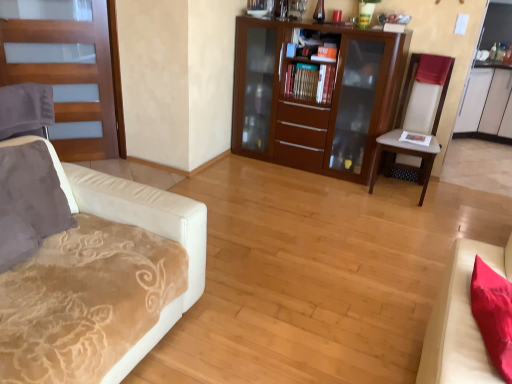
What do you see at coordinates (461, 320) in the screenshot? The image size is (512, 384). I see `velvet beige studio couch at lower right, the 2th studio couch when ordered from left to right` at bounding box center [461, 320].

This screenshot has height=384, width=512. Describe the element at coordinates (68, 70) in the screenshot. I see `wooden door at left` at that location.

What do you see at coordinates (315, 96) in the screenshot?
I see `wooden cabinet at center` at bounding box center [315, 96].

In order to face wooden cabinet at center, should I rotate leftwards or rightwards?

To align with it, rotate right about 7.935°.

Locate an element on the screen. velvet beige studio couch at lower right, the 2th studio couch when ordered from left to right is located at coordinates (461, 320).

Is wooden door at left in contact with suede-like gray pillow at left?

No, wooden door at left is not next to suede-like gray pillow at left.

I want to click on pillow above the wooden door at left (from a real-world perspective), so click(35, 187).

Is wooden door at left looking in the opposite direction of suede-like gray pillow at left?

No, wooden door at left is not facing the opposite direction of suede-like gray pillow at left.

Is hardcover books at center with beige fabric chair at right?

hardcover books at center and beige fabric chair at right are not in contact.

Does point (298, 90) come closer to viewer compared to point (444, 71)?

No, it is behind (444, 71).

Can you confirm if hardcover books at center is bigger than beige fabric chair at right?

Incorrect, hardcover books at center is not larger than beige fabric chair at right.

Identify the location of chair in front of the hardcover books at center. (416, 120).

Is point (295, 78) farther from camera compared to point (24, 148)?

Yes, it is.

You are a GUI agent. You are given a task and a screenshot of the screen. Output one action in this format:
    pyautogui.click(x=<x>, y=<y>)
    Task: Click on the book positioned vertically above the suede-like gray pillow at left (from a real-world perspective)
    
    Given the screenshot: What is the action you would take?
    pyautogui.click(x=310, y=82)

Consider the image. Is the surface of hardcover books at center in direct contact with suede-like gray pillow at left?

They are not placed beside each other.

Considering the relative sizes of wooden cabinet at center and velvet beige couch at left, the 1th studio couch in the left-to-right sequence, in the image provided, is wooden cabinet at center taller than velvet beige couch at left, the 1th studio couch in the left-to-right sequence,?

Correct, wooden cabinet at center is much taller as velvet beige couch at left, the 1th studio couch in the left-to-right sequence.

Which of these two, wooden cabinet at center or velvet beige couch at left, the 1th studio couch in the left-to-right sequence, is thinner?

Thinner between the two is wooden cabinet at center.

Can you confirm if wooden cabinet at center is smaller than velvet beige couch at left, marked as the 2th studio couch in a right-to-left arrangement?

Yes.

Which object is positioned more to the right, velvet beige studio couch at lower right, the 2th studio couch when ordered from left to right, or velvet beige couch at left, marked as the 2th studio couch in a right-to-left arrangement?

From the viewer's perspective, velvet beige studio couch at lower right, the 2th studio couch when ordered from left to right, appears more on the right side.

Between velvet beige studio couch at lower right, the 1th studio couch positioned from the right, and velvet beige couch at left, the 1th studio couch in the left-to-right sequence, which one has larger size?

velvet beige couch at left, the 1th studio couch in the left-to-right sequence, is bigger.

How many degrees apart are the facing directions of velvet beige studio couch at lower right, the 2th studio couch when ordered from left to right, and velvet beige couch at left, the 1th studio couch in the left-to-right sequence?

95.1 degrees separate the facing orientations of velvet beige studio couch at lower right, the 2th studio couch when ordered from left to right, and velvet beige couch at left, the 1th studio couch in the left-to-right sequence.

Is velvet beige studio couch at lower right, the 1th studio couch positioned from the right, facing towards velvet beige couch at left, the 1th studio couch in the left-to-right sequence?

No.

Would you say velvet beige couch at left, the 1th studio couch in the left-to-right sequence, is part of beige fabric chair at right's contents?

No, velvet beige couch at left, the 1th studio couch in the left-to-right sequence, is not a part of beige fabric chair at right.

The height and width of the screenshot is (384, 512). I want to click on studio couch directly beneath the beige fabric chair at right (from a real-world perspective), so click(x=140, y=226).

From the image's perspective, which object appears higher, beige fabric chair at right or velvet beige couch at left, marked as the 2th studio couch in a right-to-left arrangement?

beige fabric chair at right is shown above in the image.

Considering the sizes of objects beige fabric chair at right and velvet beige couch at left, marked as the 2th studio couch in a right-to-left arrangement, in the image provided, who is taller, beige fabric chair at right or velvet beige couch at left, marked as the 2th studio couch in a right-to-left arrangement,?

beige fabric chair at right is taller.

Between wooden door at left and hardcover books at center, which one appears on the left side from the viewer's perspective?

From the viewer's perspective, wooden door at left appears more on the left side.

Find the location of a particular element. door lying below the hardcover books at center (from the image's perspective) is located at coordinates (68, 70).

Between wooden door at left and hardcover books at center, which one has more height?

With more height is wooden door at left.

Identify the location of door on the left side of suede-like gray pillow at left. (68, 70).

Image resolution: width=512 pixels, height=384 pixels. In the image, there is a hardcover books at center. What are the coordinates of `chair below it (from a real-world perspective)` in the screenshot? It's located at (416, 120).

Estimate the real-world distances between objects in this image. Which object is closer to velvet beige couch at left, the 1th studio couch in the left-to-right sequence, velvet beige studio couch at lower right, the 2th studio couch when ordered from left to right, or beige fabric chair at right?

velvet beige studio couch at lower right, the 2th studio couch when ordered from left to right, is positioned closer to the anchor velvet beige couch at left, the 1th studio couch in the left-to-right sequence.

From the image, which object appears to be nearer to suede-like gray pillow at left, hardcover books at center or beige fabric chair at right?

The object closer to suede-like gray pillow at left is hardcover books at center.

From the image, which object appears to be nearer to suede-like gray pillow at left, beige fabric chair at right or velvet beige studio couch at lower right, the 1th studio couch positioned from the right?

velvet beige studio couch at lower right, the 1th studio couch positioned from the right, lies closer to suede-like gray pillow at left than the other object.

In the scene shown: Estimate the real-world distances between objects in this image. Which object is further from wooden door at left, suede-like gray pillow at left or velvet beige couch at left, marked as the 2th studio couch in a right-to-left arrangement?

The object further to wooden door at left is suede-like gray pillow at left.

From the image, which object appears to be farther from velvet beige couch at left, marked as the 2th studio couch in a right-to-left arrangement, hardcover books at center or velvet beige studio couch at lower right, the 1th studio couch positioned from the right?

hardcover books at center is positioned further to the anchor velvet beige couch at left, marked as the 2th studio couch in a right-to-left arrangement.

Estimate the real-world distances between objects in this image. Which object is closer to beige fabric chair at right, suede-like gray pillow at left or wooden cabinet at center?

wooden cabinet at center.

Based on their spatial positions, is beige fabric chair at right or suede-like gray pillow at left further from wooden cabinet at center?

The object further to wooden cabinet at center is suede-like gray pillow at left.

When comparing their distances from velvet beige couch at left, the 1th studio couch in the left-to-right sequence, does suede-like gray pillow at left or velvet beige studio couch at lower right, the 2th studio couch when ordered from left to right, seem closer?

suede-like gray pillow at left lies closer to velvet beige couch at left, the 1th studio couch in the left-to-right sequence, than the other object.

The width and height of the screenshot is (512, 384). Find the location of `pillow located between velvet beige couch at left, the 1th studio couch in the left-to-right sequence, and hardcover books at center in the depth direction`. pillow located between velvet beige couch at left, the 1th studio couch in the left-to-right sequence, and hardcover books at center in the depth direction is located at coordinates (35, 187).

Locate an element on the screen. The image size is (512, 384). cabinetry between wooden door at left and velvet beige studio couch at lower right, the 2th studio couch when ordered from left to right is located at coordinates 315,96.

Locate an element on the screen. The width and height of the screenshot is (512, 384). studio couch located between wooden door at left and velvet beige studio couch at lower right, the 1th studio couch positioned from the right, in the left-right direction is located at coordinates (140, 226).

Where is `cabinetry situated between wooden door at left and beige fabric chair at right from left to right`? cabinetry situated between wooden door at left and beige fabric chair at right from left to right is located at coordinates (315, 96).